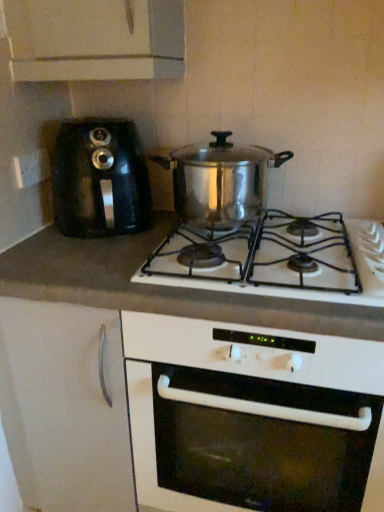
You are a GUI agent. You are given a task and a screenshot of the screen. Output one action in this format:
    pyautogui.click(x=<x>, y=<y>)
    Task: Click on the free point in front of black plastic coffee machine at left
    
    Given the screenshot: What is the action you would take?
    pyautogui.click(x=71, y=261)